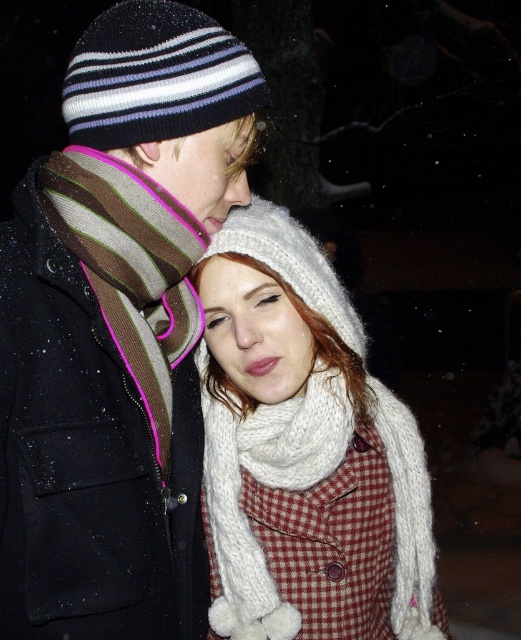
Question: Does white knitted hat at center have a lesser width compared to striped knit scarf at left?

Choices:
 (A) no
 (B) yes

Answer: (A)

Question: Is white knitted hat at center wider than striped knit scarf at left?

Choices:
 (A) yes
 (B) no

Answer: (A)

Question: Among these objects, which one is farthest from the camera?

Choices:
 (A) white knitted hat at center
 (B) striped knit scarf at left

Answer: (A)

Question: Which point is farther to the camera?

Choices:
 (A) (120, 355)
 (B) (319, 257)

Answer: (B)

Question: Can you confirm if white knitted hat at center is positioned to the right of striped knit scarf at left?

Choices:
 (A) no
 (B) yes

Answer: (B)

Question: Among these objects, which one is nearest to the camera?

Choices:
 (A) white knitted hat at center
 (B) striped knit scarf at left

Answer: (B)